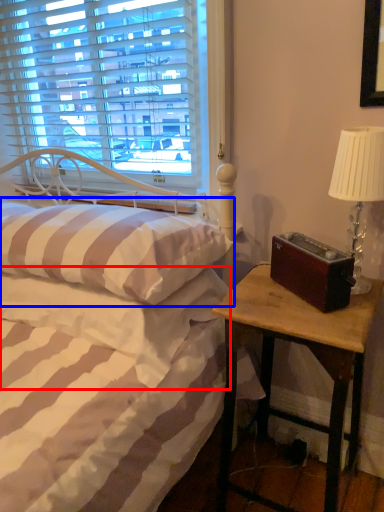
Question: Among these objects, which one is nearest to the camera, mattress (highlighted by a red box) or pillow (highlighted by a blue box)?

Choices:
 (A) mattress
 (B) pillow

Answer: (B)